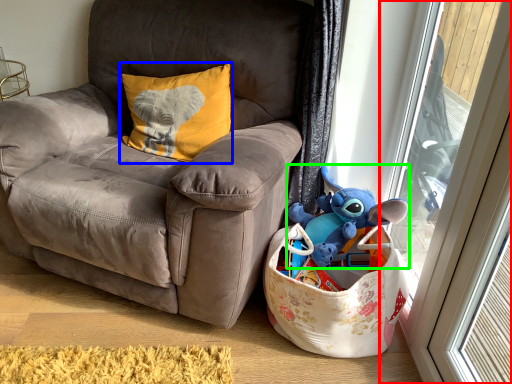
Question: Which object is the farthest from glass door (highlighted by a red box)? Choose among these: pillow (highlighted by a blue box) or toy (highlighted by a green box).

Choices:
 (A) pillow
 (B) toy

Answer: (A)